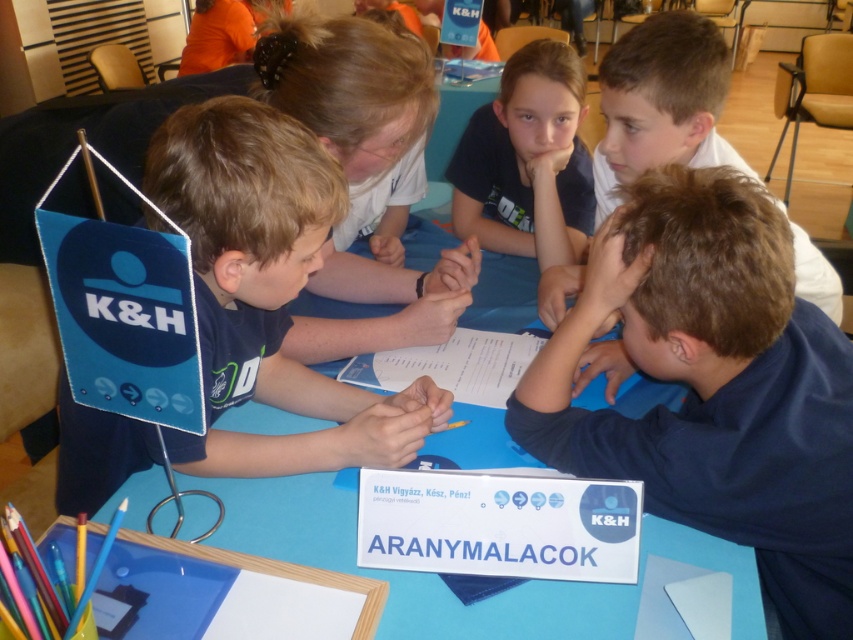
Question: In this image, where is dark blue shirt at lower right located relative to matte blue sign at left?

Choices:
 (A) right
 (B) left

Answer: (A)

Question: Among these points, which one is nearest to the camera?

Choices:
 (A) (721, 145)
 (B) (579, 225)

Answer: (A)

Question: Is blue paper table at center to the right of dark blue shirt at upper right from the viewer's perspective?

Choices:
 (A) yes
 (B) no

Answer: (B)

Question: Which of the following is the farthest from the observer?

Choices:
 (A) 564,172
 (B) 257,385
 (C) 741,561
 (D) 763,257

Answer: (A)

Question: Which of the following is the farthest from the observer?

Choices:
 (A) dark blue t-shirt at upper center
 (B) matte blue sign at left
 (C) dark blue shirt at upper right
 (D) blue paper table at center

Answer: (A)

Question: Does dark blue shirt at upper right appear on the right side of dark blue t-shirt at upper center?

Choices:
 (A) no
 (B) yes

Answer: (B)